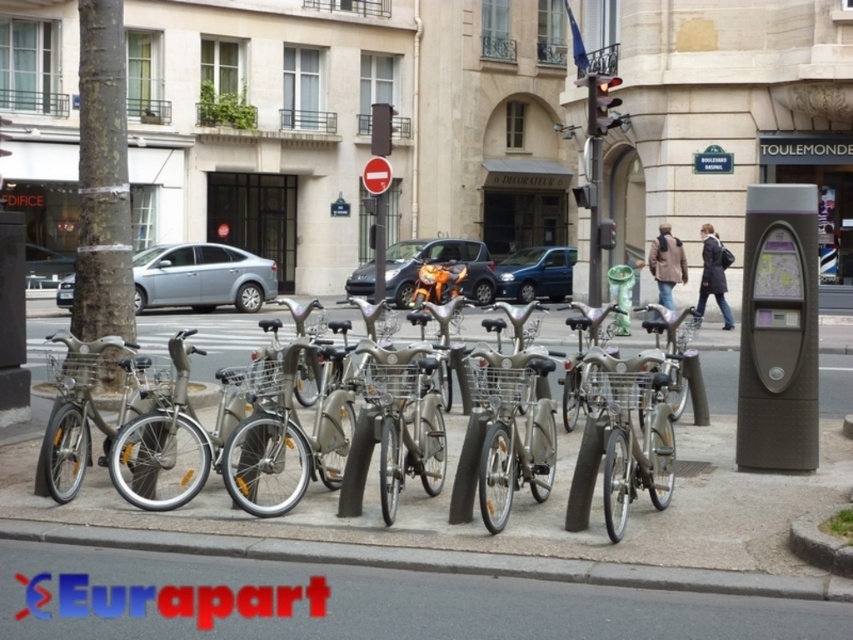
You are a delivery person trying to park your silver metallic bicycle at center near the gray concrete curb at lower center. Based on the scene, can you safely park the bicycle on the curb without it tipping over?

The silver metallic bicycle at center is further to the viewer than the gray concrete curb at lower center, meaning the bicycle is positioned closer to you. Since the curb is behind the bicycle, you can safely park the bicycle on the curb as it is already aligned properly and the curb is part of the sidewalk where bicycles are typically parked.

You are a delivery person who needs to load a silver metallic bicycle at center onto a truck that has a height restriction of 1.5 meters. Given that the matte gray parking meter at right is exactly 1.5 meters tall, can the bicycle be loaded without bending its frame?

The silver metallic bicycle at center is not as tall as the matte gray parking meter at right, which is exactly 1.5 meters tall. Therefore, the bicycle can be loaded onto the truck without bending its frame since it is shorter than the height restriction.